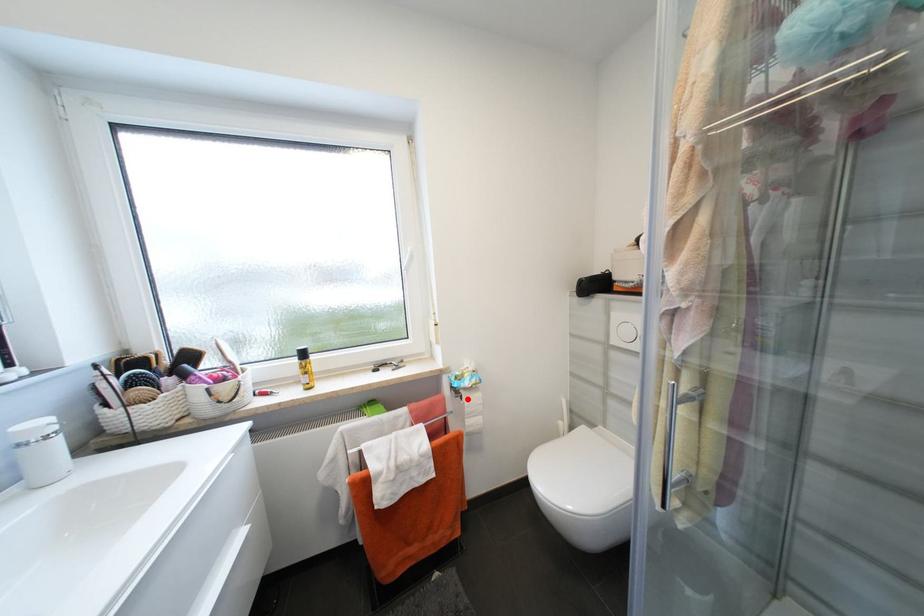
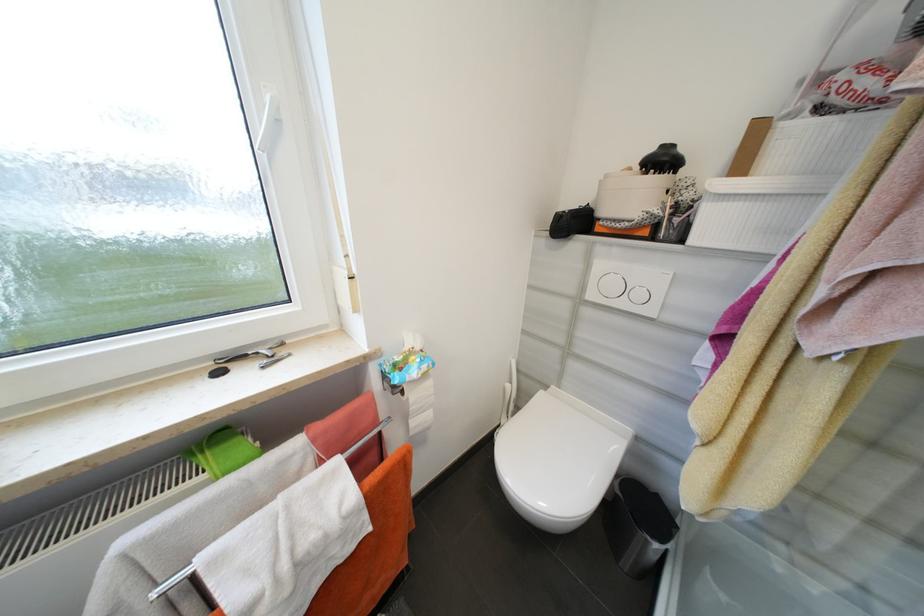
Locate, in the second image, the point that corresponds to the highlighted location in the first image.

(407, 392)